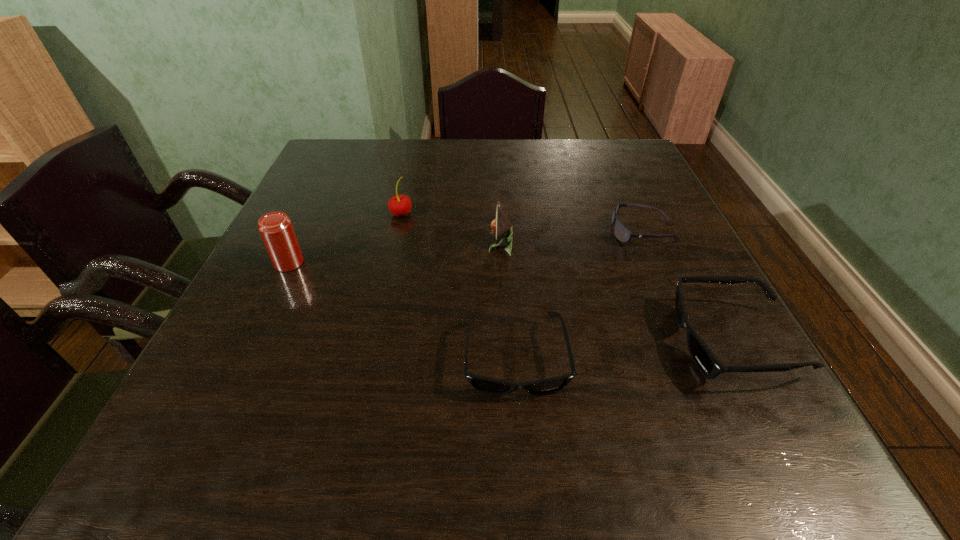
Please point a free position for a sunglasses on the left. Please provide its 2D coordinates. Your answer should be formatted as a tuple, i.e. [(x, y)], where the tuple contains the x and y coordinates of a point satisfying the conditions above.

[(283, 377)]